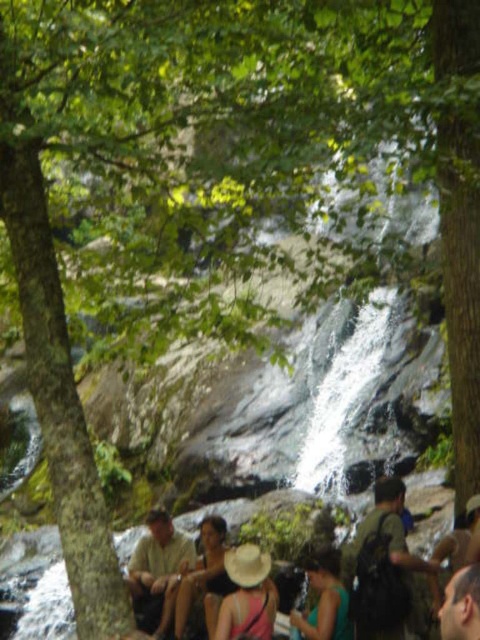
You are a photographer planning to take a photo of the waterfall scene. You want to ensure both the light brown fabric shirt at lower left and the green matte dress at center are visible in the frame. Considering their sizes, which clothing item might require you to zoom out slightly to fully capture it?

The green matte dress at center is thicker than the light brown fabric shirt at lower left, so you might need to zoom out slightly to fully capture the green matte dress at center in the frame.

You are planning to pack your belongings into a green fabric backpack at center and a beige straw hat at center. Which item has more vertical space available for packing items?

The green fabric backpack at center has more vertical space available for packing items since it is much taller than the beige straw hat at center.